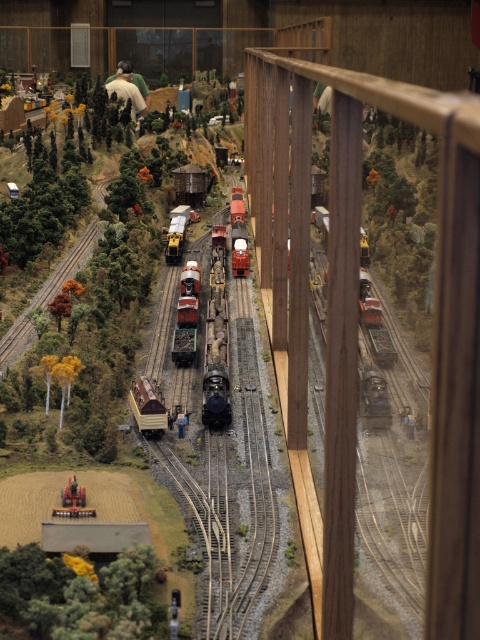
You are a visitor at the model railway exhibit and want to locate the matte brown wooden train car at center. According to the coordinate system where the bottom left corner is the origin, can you confirm if the matte brown wooden train car at center is positioned at point (147, 406)?

Yes, the matte brown wooden train car at center is located at point (147, 406) as per the coordinate system described.

You are a model railway enthusiast who wants to place a new train car between the matte brown wooden train car at center and the metallic silver train at center. Which train car should you attach it to if you want the new car to be closer to the shorter one?

Result: The matte brown wooden train car at center is shorter than the metallic silver train at center. Therefore, you should attach the new train car to the matte brown wooden train car at center to keep it closer to the shorter one.

You are a visitor at the model railway exhibit and want to take a photo of both the matte brown wooden train car at center and the metallic silver train at center. Based on their positions, which one should you focus on first to ensure both are in the frame?

The metallic silver train at center should be focused on first because the matte brown wooden train car at center is to its right, so positioning the camera to include both would require starting with the metallic silver train at center.